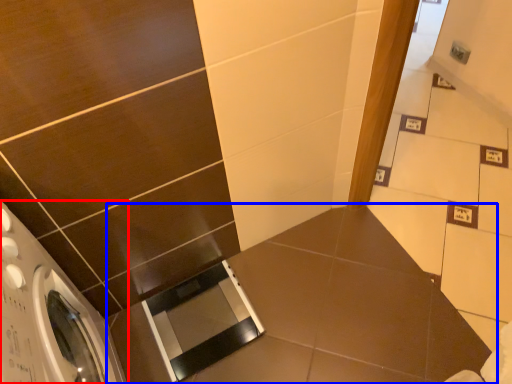
Question: Among these objects, which one is farthest to the camera, washing machine (highlighted by a red box) or counter top (highlighted by a blue box)?

Choices:
 (A) washing machine
 (B) counter top

Answer: (B)